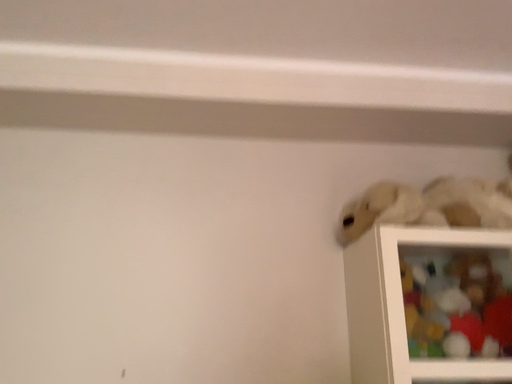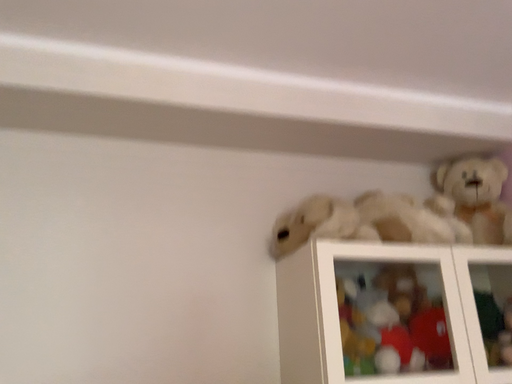
Question: Which way did the camera rotate in the video?

Choices:
 (A) rotated right
 (B) rotated left

Answer: (A)